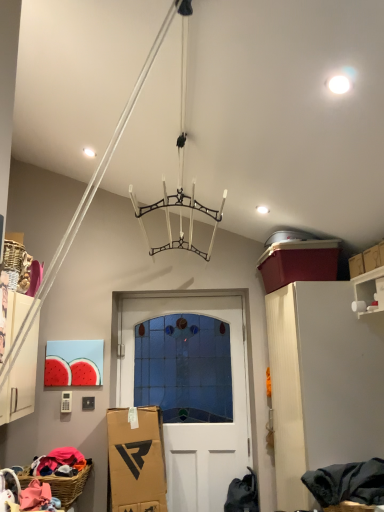
Question: Is woven brown basket at lower left shorter than white glass door at center?

Choices:
 (A) yes
 (B) no

Answer: (A)

Question: Is woven brown basket at lower left behind white glass door at center?

Choices:
 (A) no
 (B) yes

Answer: (A)

Question: Is the depth of woven brown basket at lower left less than that of white glass door at center?

Choices:
 (A) no
 (B) yes

Answer: (B)

Question: From a real-world perspective, is woven brown basket at lower left positioned over white glass door at center based on gravity?

Choices:
 (A) no
 (B) yes

Answer: (A)

Question: Does woven brown basket at lower left have a smaller size compared to white glass door at center?

Choices:
 (A) yes
 (B) no

Answer: (A)

Question: Can you confirm if woven brown basket at lower left is positioned to the right of white glass door at center?

Choices:
 (A) yes
 (B) no

Answer: (B)

Question: Considering the relative positions of white glossy shelf at upper right and dark gray fabric at lower right in the image provided, is white glossy shelf at upper right to the left of dark gray fabric at lower right from the viewer's perspective?

Choices:
 (A) yes
 (B) no

Answer: (B)

Question: Does white glossy shelf at upper right have a lesser height compared to dark gray fabric at lower right?

Choices:
 (A) no
 (B) yes

Answer: (A)

Question: Is white glossy shelf at upper right looking in the opposite direction of dark gray fabric at lower right?

Choices:
 (A) no
 (B) yes

Answer: (A)

Question: Is white glossy shelf at upper right at the right side of dark gray fabric at lower right?

Choices:
 (A) no
 (B) yes

Answer: (B)

Question: From a real-world perspective, is white glossy shelf at upper right on dark gray fabric at lower right?

Choices:
 (A) yes
 (B) no

Answer: (A)

Question: From the image's perspective, is white glossy shelf at upper right under dark gray fabric at lower right?

Choices:
 (A) no
 (B) yes

Answer: (A)

Question: Is white matte cabinet at right turned away from woven brown basket at lower left?

Choices:
 (A) yes
 (B) no

Answer: (B)